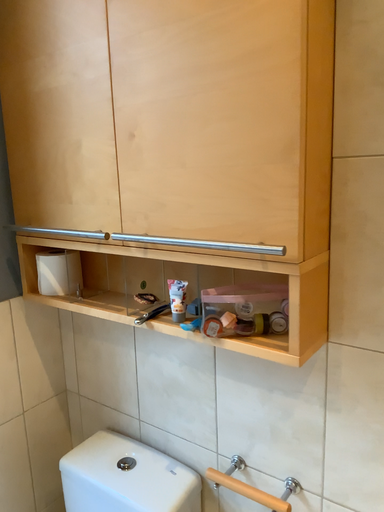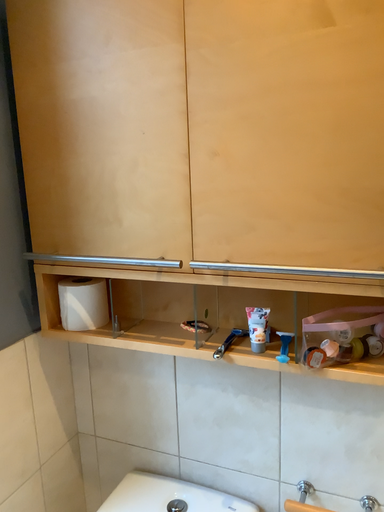
Question: How did the camera likely rotate when shooting the video?

Choices:
 (A) rotated left
 (B) rotated right

Answer: (B)